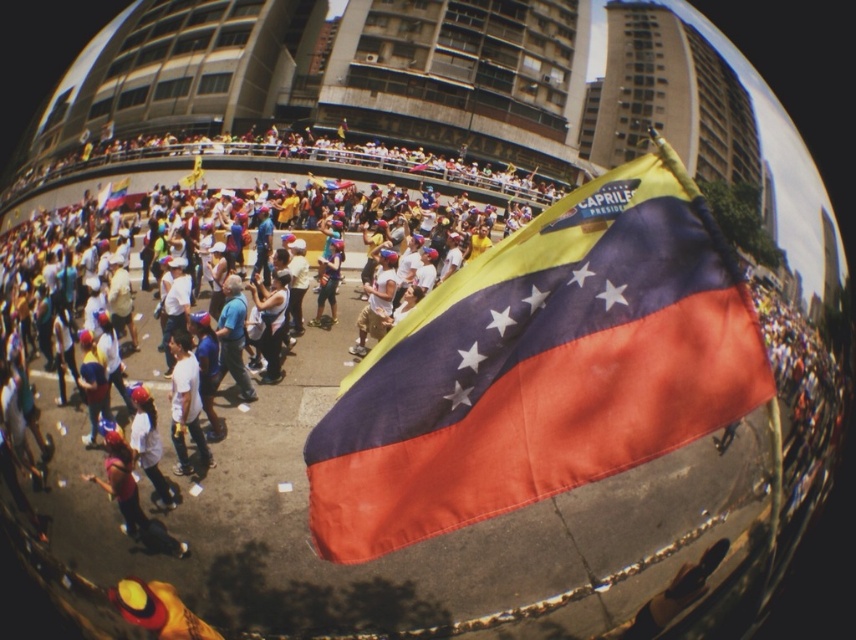
Question: Which point is closer to the camera taking this photo?

Choices:
 (A) (358, 332)
 (B) (488, 378)

Answer: (B)

Question: Where is polyester flag at center located in relation to white matte shirt at center in the image?

Choices:
 (A) above
 (B) below

Answer: (A)

Question: Can you confirm if white matte shirt at center is positioned below light brown fabric pants at center?

Choices:
 (A) no
 (B) yes

Answer: (B)

Question: Based on their relative distances, which object is nearer to the white matte shirt at center?

Choices:
 (A) light brown fabric pants at center
 (B) polyester flag at center

Answer: (B)

Question: Is polyester flag at center bigger than white matte shirt at center?

Choices:
 (A) no
 (B) yes

Answer: (B)

Question: Based on their relative distances, which object is nearer to the light brown fabric pants at center?

Choices:
 (A) polyester flag at center
 (B) white matte shirt at center

Answer: (B)